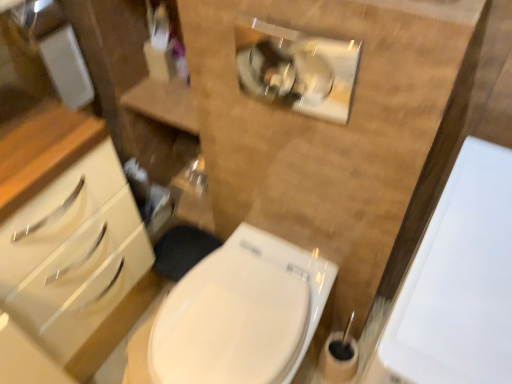
Question: From the image's perspective, is white glossy toilet at center positioned above or below white glossy porcelain at right?

Choices:
 (A) above
 (B) below

Answer: (B)

Question: Considering the positions of white glossy toilet at center and white glossy porcelain at right in the image, is white glossy toilet at center taller or shorter than white glossy porcelain at right?

Choices:
 (A) short
 (B) tall

Answer: (A)

Question: Based on their positions, is white glossy toilet at center located to the left or right of white glossy porcelain at right?

Choices:
 (A) left
 (B) right

Answer: (A)

Question: From a real-world perspective, relative to white glossy toilet at center, is white glossy porcelain at right vertically above or below?

Choices:
 (A) below
 (B) above

Answer: (B)

Question: Does point (480, 297) appear closer or farther from the camera than point (226, 309)?

Choices:
 (A) farther
 (B) closer

Answer: (B)

Question: In terms of size, does white glossy porcelain at right appear bigger or smaller than white glossy toilet at center?

Choices:
 (A) big
 (B) small

Answer: (A)

Question: Is white glossy porcelain at right inside the boundaries of white glossy toilet at center, or outside?

Choices:
 (A) outside
 (B) inside

Answer: (A)